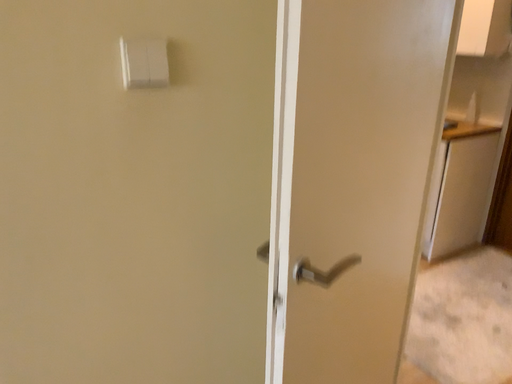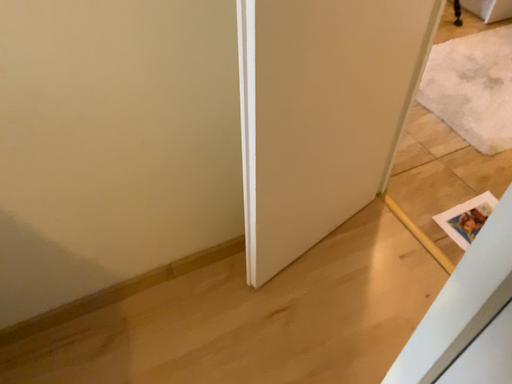
Question: Which way did the camera rotate in the video?

Choices:
 (A) rotated upward
 (B) rotated downward

Answer: (B)